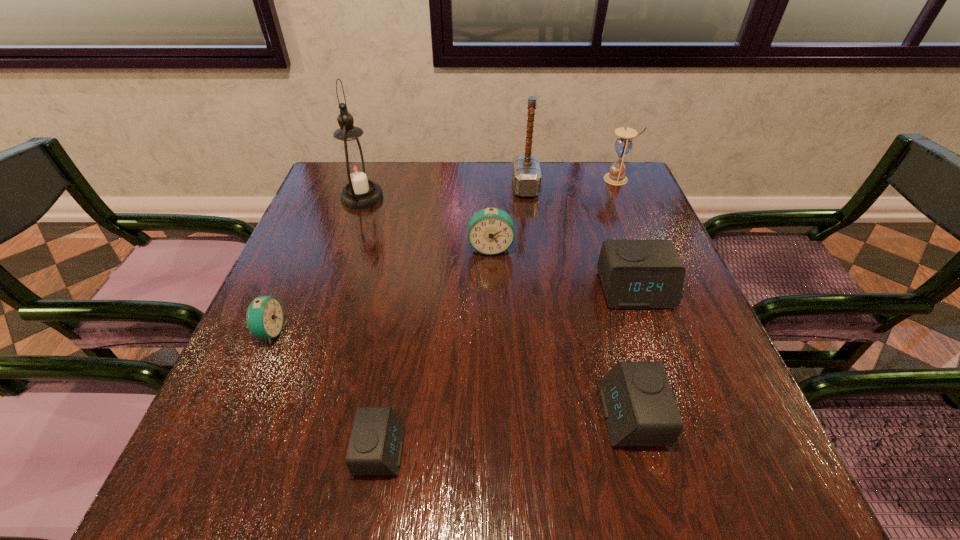
The width and height of the screenshot is (960, 540). Identify the location of the third farthest alarm clock. (264, 317).

At what (x,y) coordinates should I click in order to perform the action: click on the leftmost alarm clock. Please return your answer as a coordinate pair (x, y). This screenshot has width=960, height=540. Looking at the image, I should click on (264, 317).

Where is `the second smallest black alarm clock`? Image resolution: width=960 pixels, height=540 pixels. the second smallest black alarm clock is located at coordinates (639, 407).

What are the coordinates of `the shortest alarm clock` in the screenshot? It's located at (375, 448).

Where is `the smallest black alarm clock`? The image size is (960, 540). the smallest black alarm clock is located at coordinates (375, 448).

At what (x,y) coordinates should I click in order to perform the action: click on free space located on the right of the second object from left to right. Please return your answer as a coordinate pair (x, y). Looking at the image, I should click on (466, 198).

Where is `vacant region located on the striking surface of the second tallest object`? Image resolution: width=960 pixels, height=540 pixels. vacant region located on the striking surface of the second tallest object is located at coordinates [377, 187].

The width and height of the screenshot is (960, 540). I want to click on free space located 0.220m on the striking surface of the second tallest object, so click(436, 187).

This screenshot has width=960, height=540. I want to click on free region located on the striking surface of the second tallest object, so click(388, 187).

You are a GUI agent. You are given a task and a screenshot of the screen. Output one action in this format:
    pyautogui.click(x=<x>, y=<y>)
    Task: Click on the vacant space located on the front of the sixth shortest object
    The width and height of the screenshot is (960, 540).
    Given the screenshot: What is the action you would take?
    pyautogui.click(x=659, y=276)